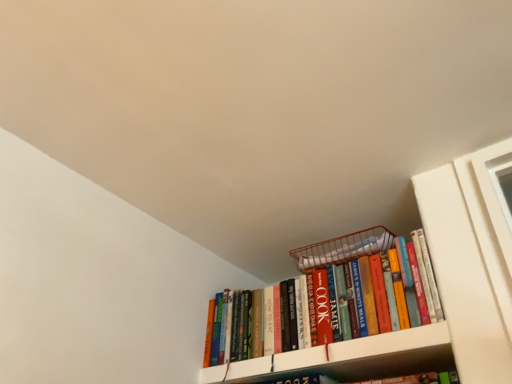
Question: Considering their positions, is hardcover books at upper right located in front of or behind white matte bookshelf at upper right?

Choices:
 (A) front
 (B) behind

Answer: (B)

Question: From the image's perspective, is hardcover books at upper right above or below white matte bookshelf at upper right?

Choices:
 (A) below
 (B) above

Answer: (B)

Question: Is hardcover books at upper right taller or shorter than white matte bookshelf at upper right?

Choices:
 (A) short
 (B) tall

Answer: (B)

Question: Is white matte bookshelf at upper right to the left or to the right of hardcover books at upper right in the image?

Choices:
 (A) left
 (B) right

Answer: (B)

Question: Does point (352, 372) appear closer or farther from the camera than point (345, 248)?

Choices:
 (A) farther
 (B) closer

Answer: (B)

Question: Considering the positions of white matte bookshelf at upper right and hardcover books at upper right in the image, is white matte bookshelf at upper right taller or shorter than hardcover books at upper right?

Choices:
 (A) short
 (B) tall

Answer: (A)

Question: From the image's perspective, is white matte bookshelf at upper right positioned above or below hardcover books at upper right?

Choices:
 (A) below
 (B) above

Answer: (A)